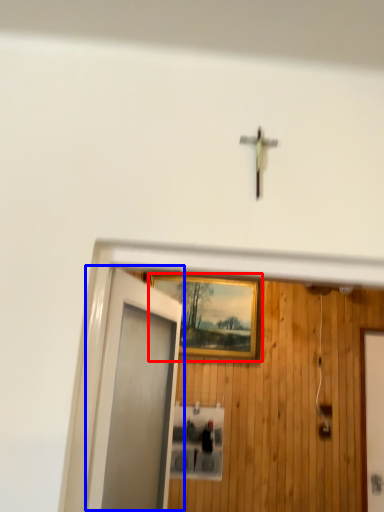
Question: Among these objects, which one is nearest to the camera, picture frame (highlighted by a red box) or door (highlighted by a blue box)?

Choices:
 (A) picture frame
 (B) door

Answer: (B)